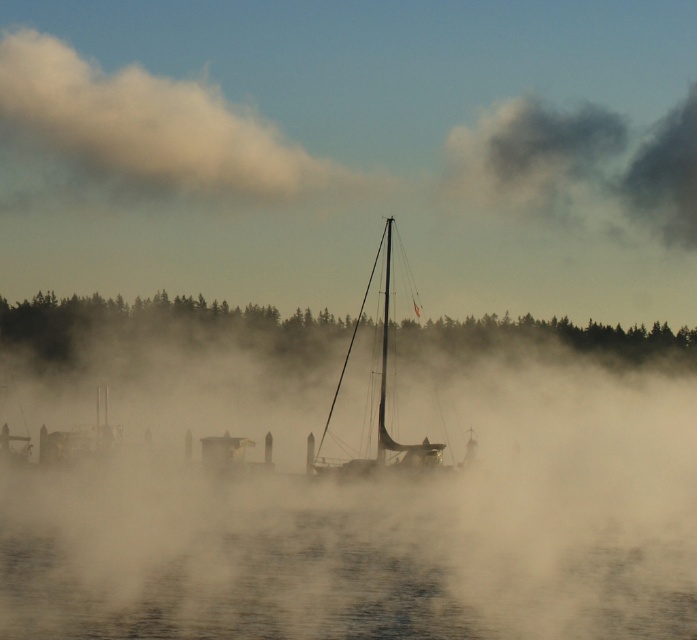
Question: Can you confirm if translucent misty water at center is positioned above shiny metallic sailboat at center?

Choices:
 (A) yes
 (B) no

Answer: (B)

Question: Is foggy white cloud at upper left bigger than shiny metallic sailboat at center?

Choices:
 (A) yes
 (B) no

Answer: (A)

Question: Which point is closer to the camera taking this photo?

Choices:
 (A) (199, 90)
 (B) (353, 474)
 (C) (144, 388)
 (D) (551, 180)

Answer: (B)

Question: Which object is the closest to the shiny metallic sailboat at center?

Choices:
 (A) dark gray fluffy cloud at upper right
 (B) foggy white cloud at upper left
 (C) translucent misty water at center

Answer: (C)

Question: Which of the following is the closest to the observer?

Choices:
 (A) shiny metallic sailboat at center
 (B) foggy white cloud at upper left
 (C) dark gray fluffy cloud at upper right

Answer: (A)

Question: Observing the image, what is the correct spatial positioning of translucent misty water at center in reference to foggy white cloud at upper left?

Choices:
 (A) below
 (B) above

Answer: (A)